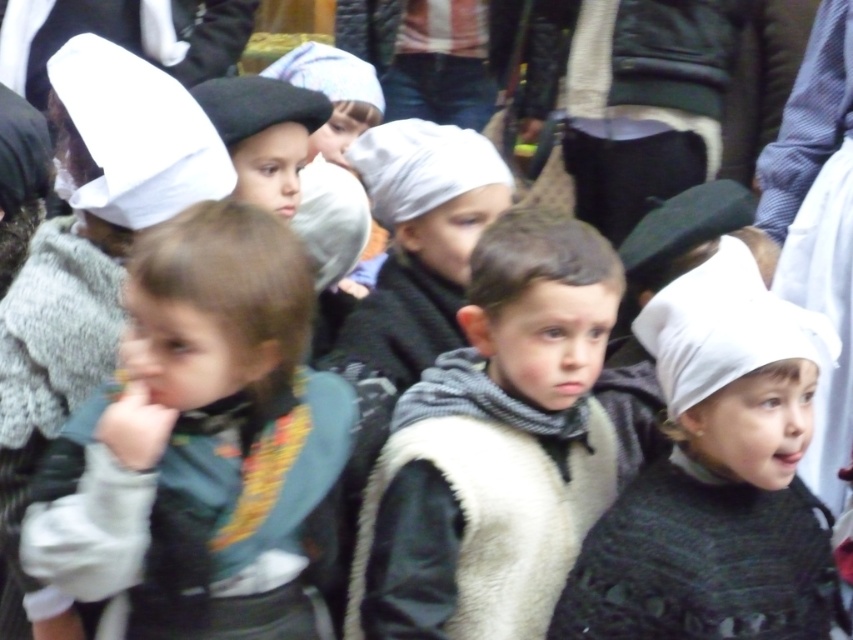
Question: Among these points, which one is nearest to the camera?

Choices:
 (A) (723, 371)
 (B) (166, 337)

Answer: (B)

Question: Does dark green sweater at center come in front of white knitted hat at center?

Choices:
 (A) no
 (B) yes

Answer: (B)

Question: Which of the following is the closest to the observer?

Choices:
 (A) dark green sweater at center
 (B) knitted gray scarf at center
 (C) white knitted hat at center

Answer: (A)

Question: Is dark green sweater at center positioned behind white knitted hat at center?

Choices:
 (A) yes
 (B) no

Answer: (B)

Question: Is dark green sweater at center wider than knitted gray scarf at center?

Choices:
 (A) no
 (B) yes

Answer: (A)

Question: Which of the following is the closest to the observer?

Choices:
 (A) (567, 616)
 (B) (242, 449)
 (C) (547, 380)

Answer: (B)